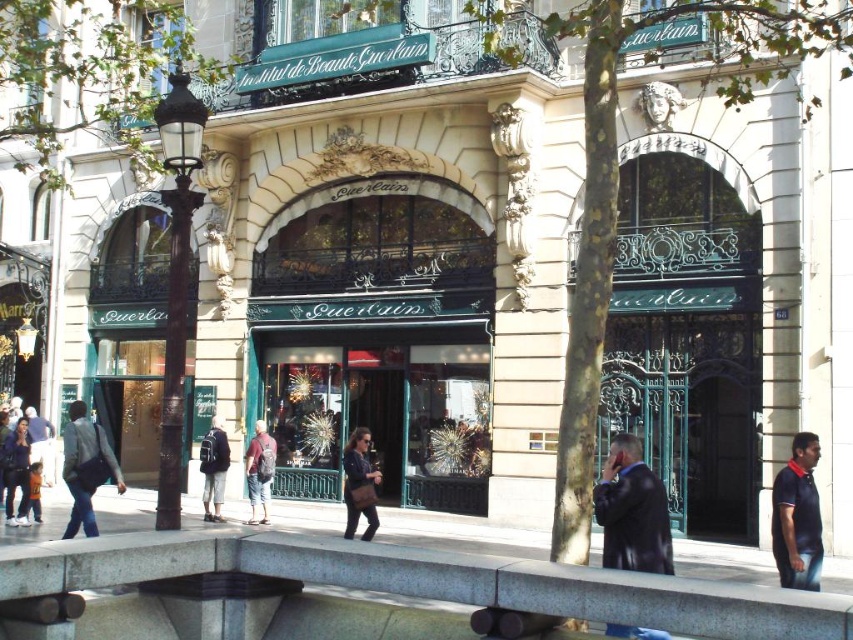
Between point (213, 513) and point (267, 436), which one is positioned in front?

Point (213, 513) is more forward.

Measure the distance between point (218, 422) and camera.

They are 58.75 meters apart.

Image resolution: width=853 pixels, height=640 pixels. Identify the location of dark blue backpack at center. (213, 468).

Which of these two, gray concrete pavement at lower center or dark blue backpack at center, stands taller?

Standing taller between the two is gray concrete pavement at lower center.

Looking at this image, which is below, gray concrete pavement at lower center or dark blue backpack at center?

Positioned lower is dark blue backpack at center.

In the scene shown: Who is more forward, (619, 572) or (215, 432)?

Point (619, 572)

This screenshot has height=640, width=853. I want to click on gray concrete pavement at lower center, so click(x=372, y=592).

Does denim jacket at lower left have a greater width compared to dark blue jeans at lower left?

No, denim jacket at lower left is not wider than dark blue jeans at lower left.

Between point (19, 500) and point (32, 458), which one is positioned behind?

Positioned behind is point (32, 458).

Which is in front, point (22, 500) or point (50, 436)?

Point (22, 500) is in front.

Where is `denim jacket at lower left`? This screenshot has height=640, width=853. denim jacket at lower left is located at coordinates (16, 472).